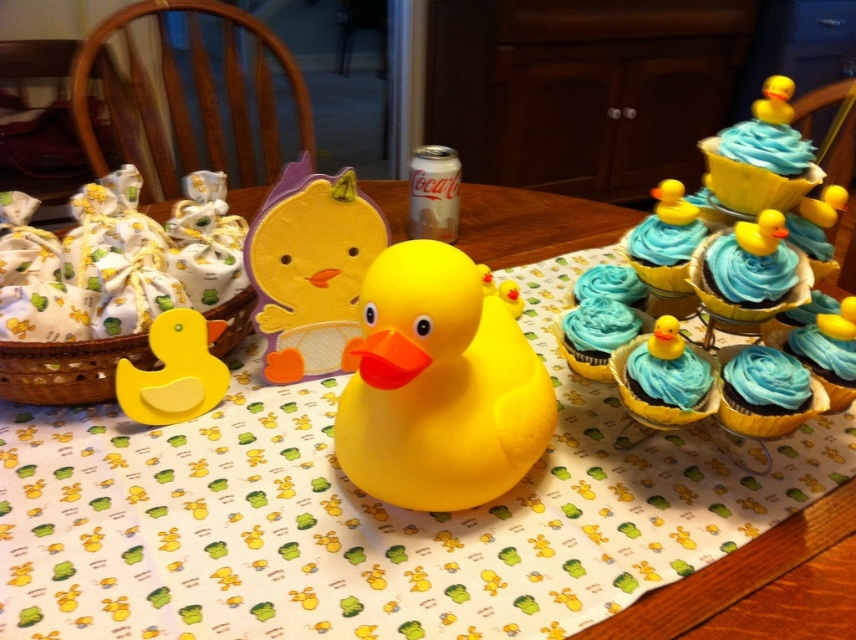
Question: Which object appears closest to the camera in this image?

Choices:
 (A) rubber duck at center
 (B) yellow rubber duck at center
 (C) blue frosting cupcake at center

Answer: (B)

Question: Considering the real-world distances, which object is closest to the rubber yellow duck at upper right?

Choices:
 (A) matte yellow rubber duck at lower left
 (B) blue frosting cupcake at center right

Answer: (B)

Question: From the image, what is the correct spatial relationship of yellow rubber duck at center in relation to rubber duck at center?

Choices:
 (A) below
 (B) above

Answer: (B)

Question: Does rubber duck at center appear under rubber yellow duck at upper right?

Choices:
 (A) no
 (B) yes

Answer: (B)

Question: Does blue frosting cupcake at center have a smaller size compared to matte blue frosting at center right?

Choices:
 (A) no
 (B) yes

Answer: (A)

Question: Estimate the real-world distances between objects in this image. Which object is closer to the yellow rubber duck at center?

Choices:
 (A) blue frosting cupcake at center right
 (B) matte blue frosting at center right

Answer: (B)